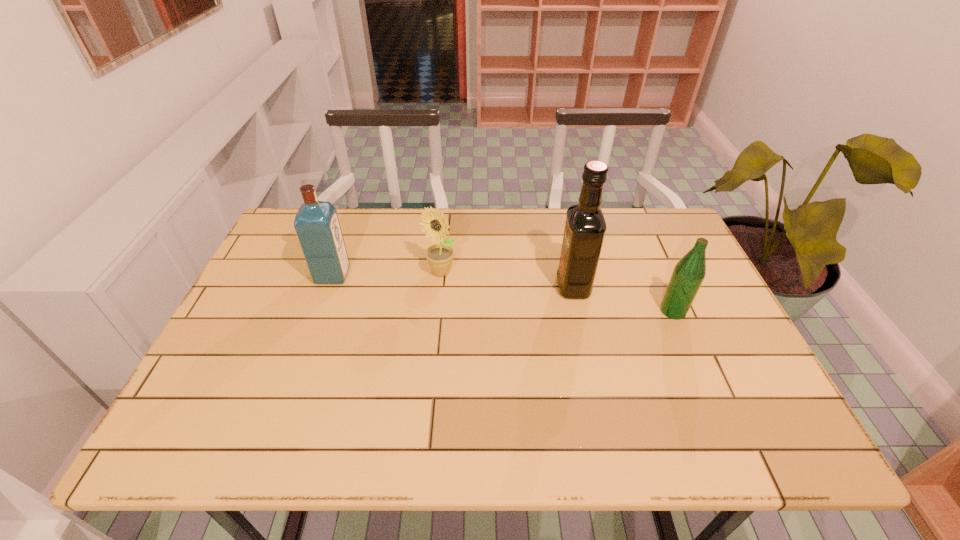
The image size is (960, 540). In order to click on vacant space that satisfies the following two spatial constraints: 1. on the face of the third object from right to left; 2. on the left side of the bottle in this screenshot , I will do `click(437, 311)`.

Where is `blank area in the image that satisfies the following two spatial constraints: 1. on the flat label side of the rightmost object; 2. on the left side of the third shortest object`? blank area in the image that satisfies the following two spatial constraints: 1. on the flat label side of the rightmost object; 2. on the left side of the third shortest object is located at coordinates (320, 311).